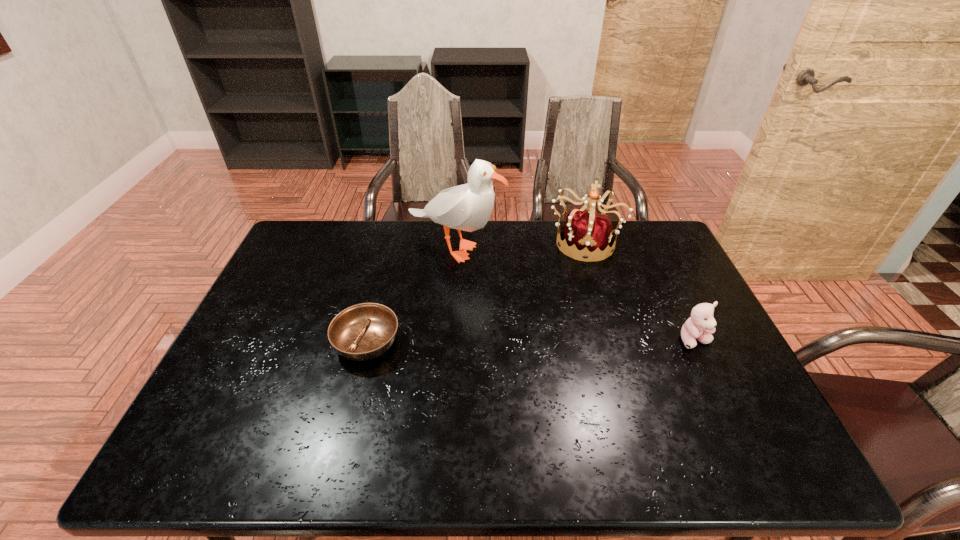
Find the location of a particular element. Image resolution: width=960 pixels, height=540 pixels. free space on the desktop that is between the soup bowl and the second shortest object and is positioned at the beak of the tallest object is located at coordinates tap(522, 341).

This screenshot has height=540, width=960. What are the coordinates of `free space on the desktop that is between the soup bowl and the rightmost object and is positioned on the front-facing side of the third object from left to right` in the screenshot? It's located at (574, 341).